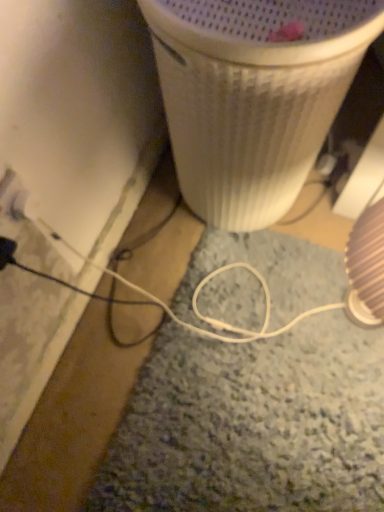
Question: Should I look upward or downward to see white ribbed plastic at center?

Choices:
 (A) down
 (B) up

Answer: (B)